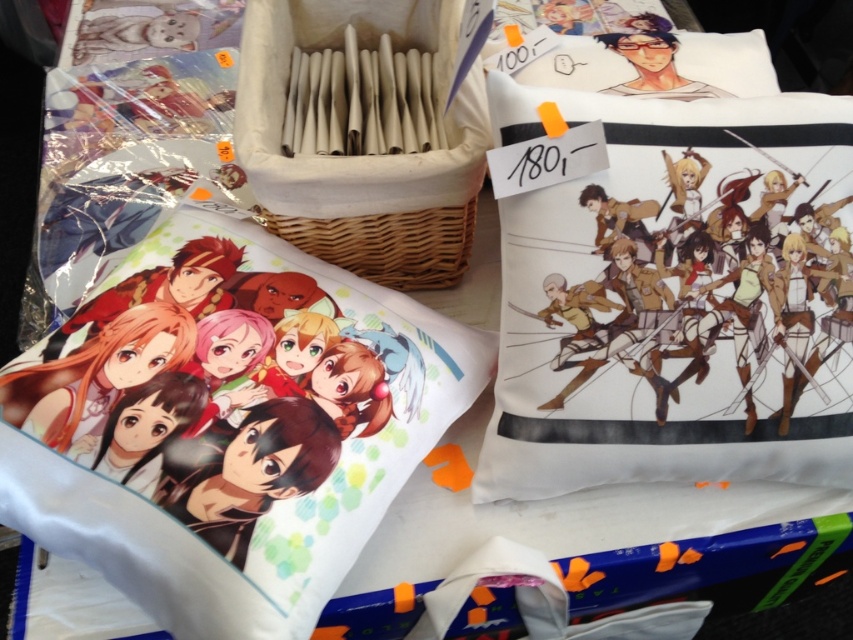
You are a customer in the store and want to place the white cotton pillow at right on a shelf that is 0.5 meters wide. Can the pillow fit on the shelf if its position is at point 0.458, 0.788?

The white cotton pillow at right is located at point (x=671, y=292). Since the shelf is 0.5 meters wide, the pillow can fit on the shelf as its position falls within the shelf dimensions.

You are a customer looking to purchase a pillow for your anime collection. You see the white cotton pillow at right and the woven wood basket at center. Which one is positioned more to the east side of the display?

The white cotton pillow at right is positioned more to the east side of the display because it is to the right of the woven wood basket at center.

You are an interior designer arranging items on a shelf. You have a white cotton pillow at right and a woven wood basket at center. Which item takes up more space on the shelf?

The woven wood basket at center occupies more space than the white cotton pillow at right.